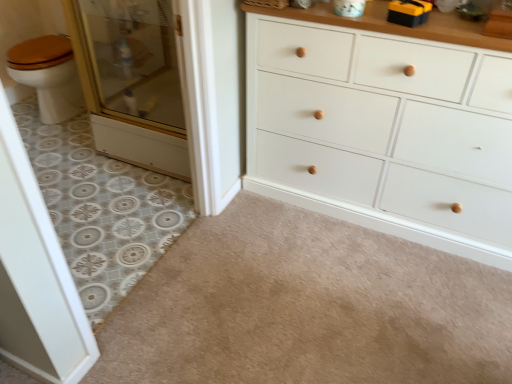
Identify the location of free region under clear glass screen door at left, the 2th screen door when ordered from bottom to top (from a real-world perspective). (132, 128).